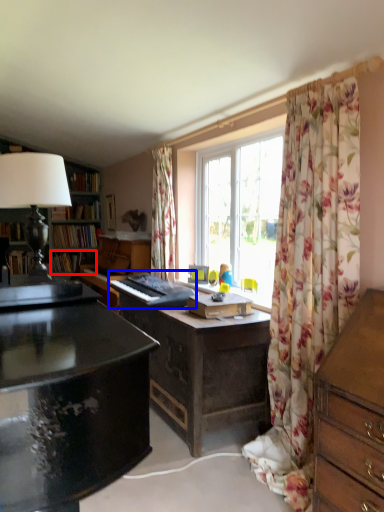
Question: Which of the following is the closest to the observer, book (highlighted by a red box) or piano (highlighted by a blue box)?

Choices:
 (A) book
 (B) piano

Answer: (B)